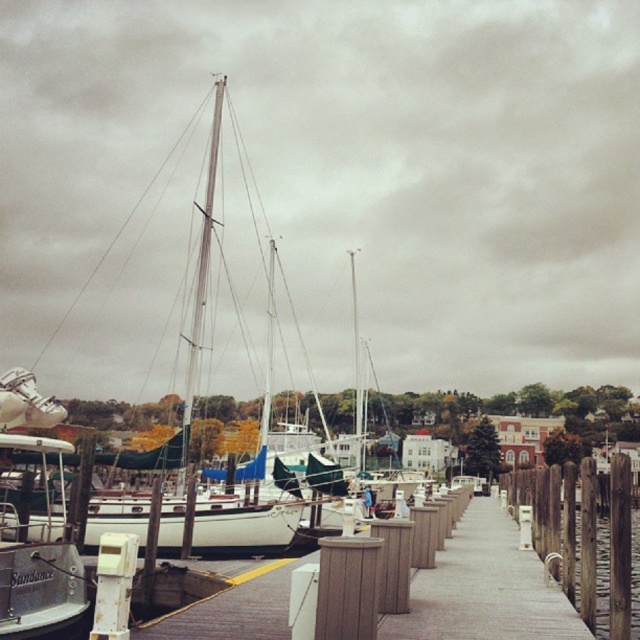
You are a dock attendant who needs to guide a new boat to the available spot between the white matte sailboat at center and the brushed metal boat at left. Based on their positions, which boat should you direct the new boat to be placed closer to?

The white matte sailboat at center is to the right of the brushed metal boat at left, so the new boat should be placed closer to the brushed metal boat at left to maintain the spacing between them.

You are planning to dock a new boat at the marina. You have two options for docking spots. One is next to the white matte sailboat at center, and the other is next to the brushed metal boat at left. Which spot requires a wider berth to accommodate your boat?

The spot next to the white matte sailboat at center requires a wider berth because its width is larger than the brushed metal boat at left.

You are a dock worker who needs to secure a new rope between the white matte sailboat at center and the brushed metal boat at left. The rope you have is 6 meters long. Will the rope be long enough to connect them?

The white matte sailboat at center is 6.14 meters from the brushed metal boat at left. Since the rope is only 6 meters long, it will be 0.14 meters too short to connect them.